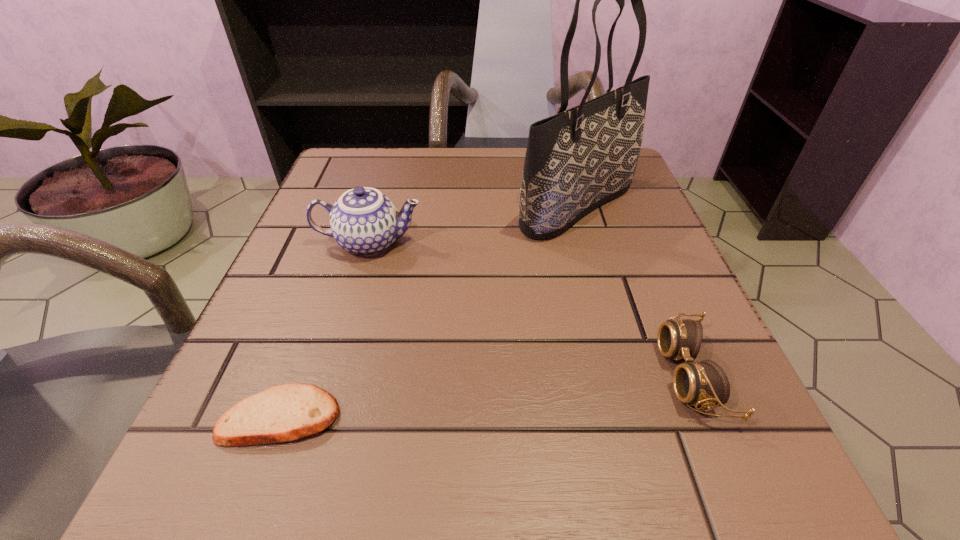
I want to click on vacant space at the left edge, so click(x=287, y=284).

Where is `vacant area at the right edge`? Image resolution: width=960 pixels, height=540 pixels. vacant area at the right edge is located at coordinates (689, 309).

The height and width of the screenshot is (540, 960). Identify the location of free space at the far left corner of the desktop. (324, 197).

The height and width of the screenshot is (540, 960). In the image, there is a desktop. In order to click on vacant area at the far right corner in this screenshot , I will do `click(619, 197)`.

In order to click on empty space that is in between the second shortest object and the shortest object in this screenshot , I will do `click(486, 396)`.

This screenshot has width=960, height=540. Find the location of `vacant space in between the shortest object and the chinaware`. vacant space in between the shortest object and the chinaware is located at coordinates (325, 329).

Where is `free space between the shortest object and the second shortest object`? The width and height of the screenshot is (960, 540). free space between the shortest object and the second shortest object is located at coordinates (486, 396).

Find the location of a particular element. The image size is (960, 540). unoccupied area between the shortest object and the goggles is located at coordinates (486, 396).

Find the location of a particular element. vacant area between the second tallest object and the tallest object is located at coordinates (473, 225).

Where is `free space that is in between the tote bag and the shortest object`? This screenshot has height=540, width=960. free space that is in between the tote bag and the shortest object is located at coordinates (429, 311).